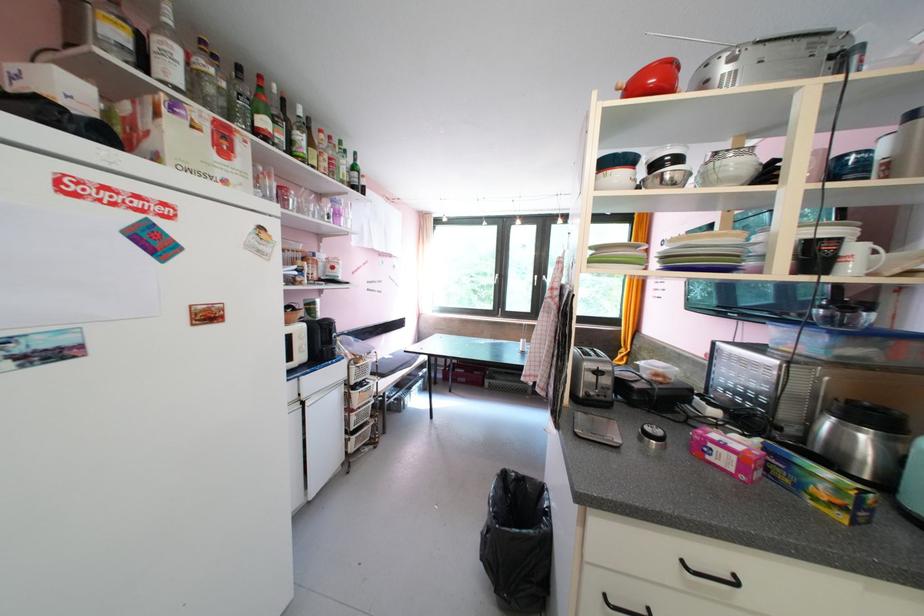
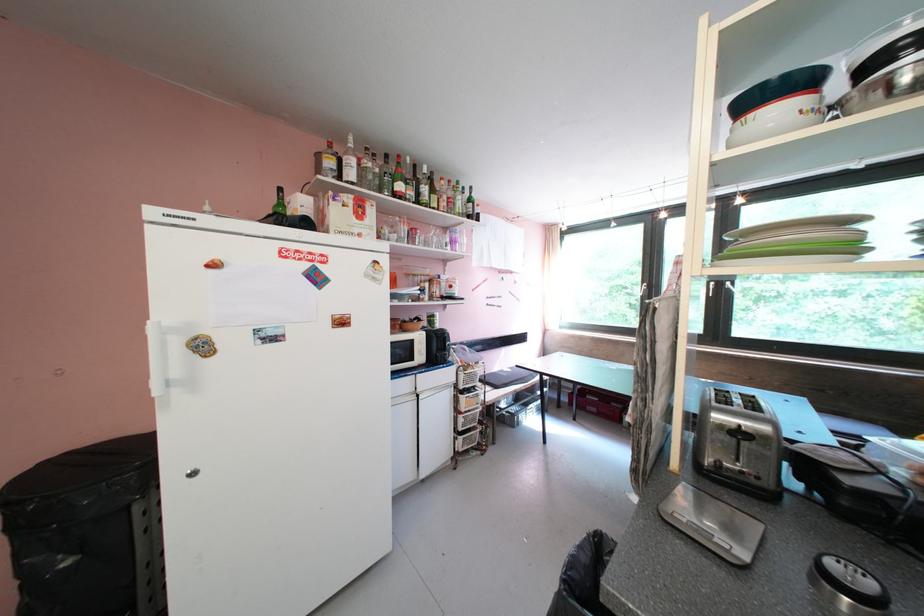
Question: The camera is either moving clockwise (left) or counter-clockwise (right) around the object. The first image is from the beginning of the video and the second image is from the end. Is the camera moving left or right when shooting the video?

Choices:
 (A) Left
 (B) Right

Answer: (B)